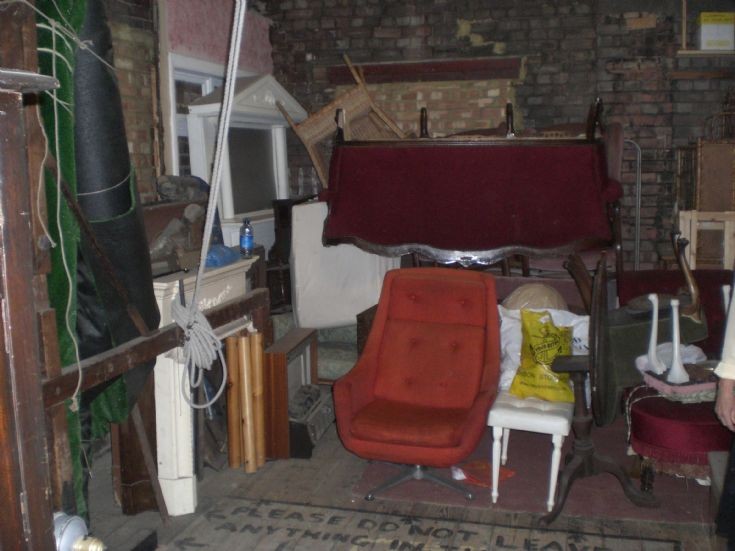
Where is `white snake like objects on the ottoman on the righ`? white snake like objects on the ottoman on the righ is located at coordinates (653, 315), (670, 321).